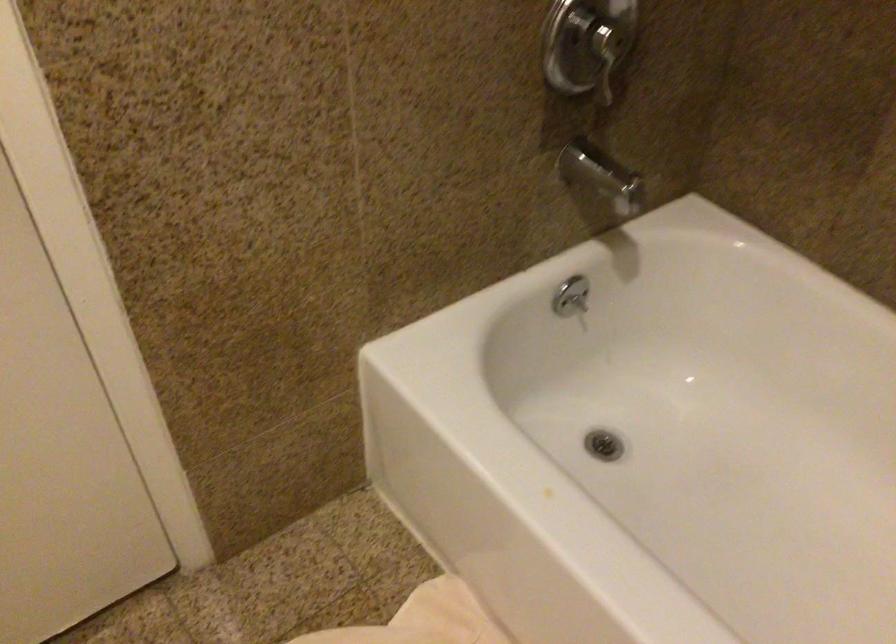
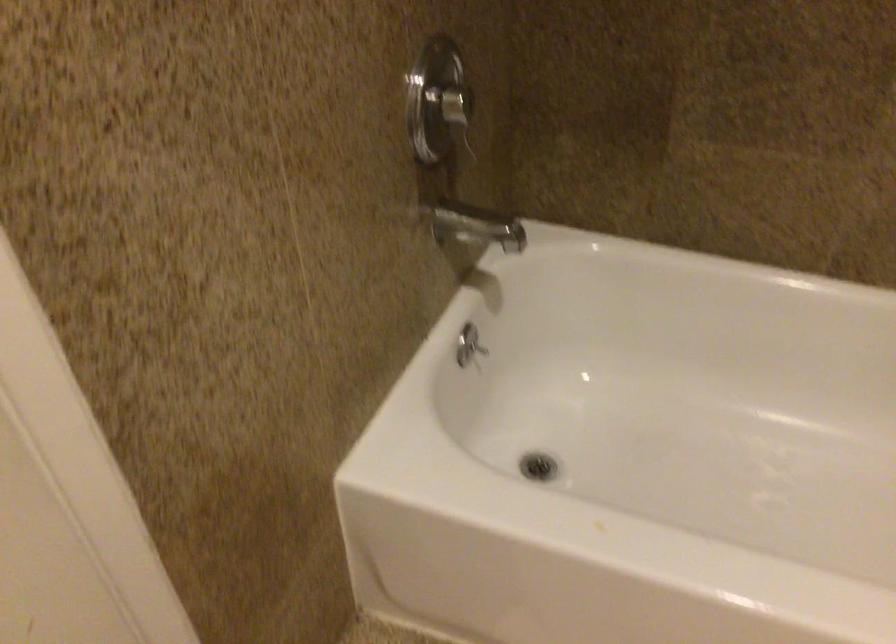
Locate, in the second image, the point that corresponds to (x=589, y=307) in the first image.

(478, 348)